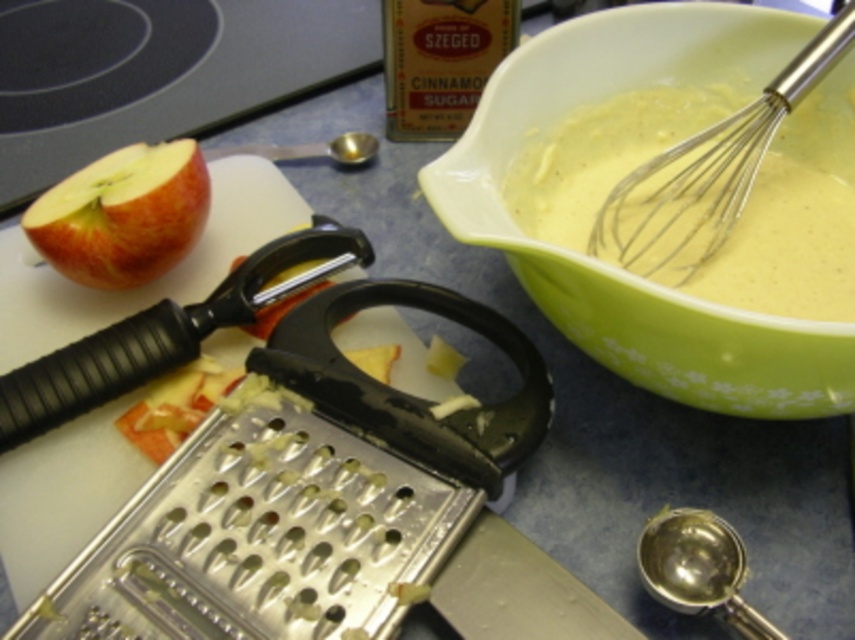
Who is lower down, green matte bowl at upper right or red matte apple at left?

green matte bowl at upper right

Who is positioned more to the right, green matte bowl at upper right or red matte apple at left?

Positioned to the right is green matte bowl at upper right.

Does point (591, 323) lie in front of point (133, 150)?

Yes, point (591, 323) is closer to viewer.

You are a GUI agent. You are given a task and a screenshot of the screen. Output one action in this format:
    pyautogui.click(x=<x>, y=<y>)
    Task: Click on the green matte bowl at upper right
    
    Given the screenshot: What is the action you would take?
    pyautogui.click(x=620, y=269)

Which is more to the right, metallic silver whisk at upper right or red matte apple at left?

From the viewer's perspective, metallic silver whisk at upper right appears more on the right side.

Is metallic silver whisk at upper right to the right of red matte apple at left from the viewer's perspective?

Indeed, metallic silver whisk at upper right is positioned on the right side of red matte apple at left.

Which is in front, point (756, 166) or point (158, 179)?

Point (158, 179) is in front.

Find the location of a particular element. metallic silver whisk at upper right is located at coordinates (711, 172).

Who is positioned more to the left, green matte bowl at upper right or metallic silver whisk at upper right?

green matte bowl at upper right is more to the left.

Consider the image. Does green matte bowl at upper right lie in front of metallic silver whisk at upper right?

Yes.

Who is more forward, (730, 6) or (675, 282)?

Point (675, 282) is more forward.

Find the location of a particular element. The width and height of the screenshot is (855, 640). green matte bowl at upper right is located at coordinates click(620, 269).